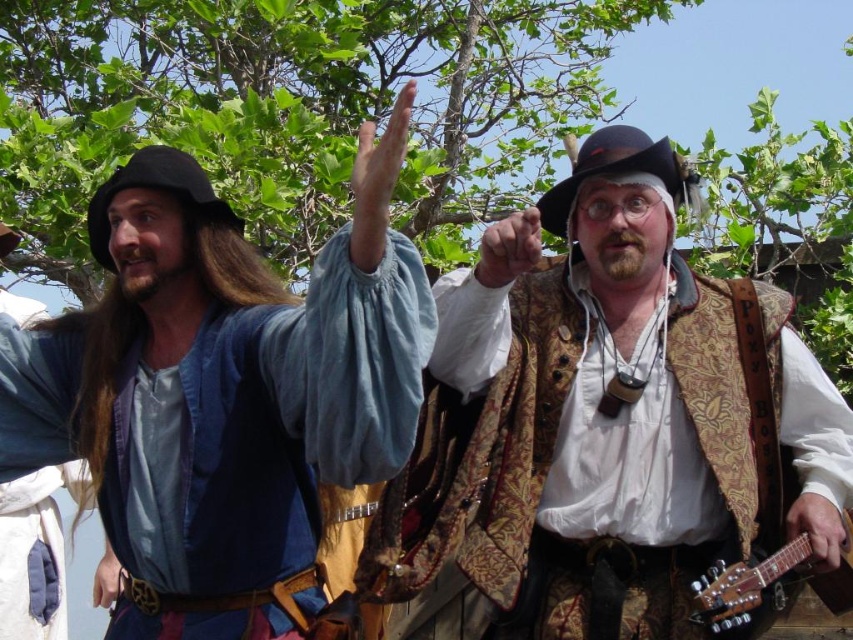
Which is below, gold-patterned vest at center or matte blue shirt at upper left?

gold-patterned vest at center is lower down.

Between point (567, 420) and point (231, 474), which one is positioned behind?

Positioned behind is point (567, 420).

Where is `gold-patterned vest at center`? This screenshot has height=640, width=853. gold-patterned vest at center is located at coordinates (601, 428).

Is white cotton shirt at left shorter than smooth skin hand at upper center?

In fact, white cotton shirt at left may be taller than smooth skin hand at upper center.

Can you confirm if white cotton shirt at left is wider than smooth skin hand at upper center?

Correct, the width of white cotton shirt at left exceeds that of smooth skin hand at upper center.

Find the location of `white cotton shirt at left`. white cotton shirt at left is located at coordinates (36, 550).

You are a GUI agent. You are given a task and a screenshot of the screen. Output one action in this format:
    pyautogui.click(x=<x>, y=<y>)
    Task: Click on the white cotton shirt at left
    
    Given the screenshot: What is the action you would take?
    pyautogui.click(x=36, y=550)

Does point (158, 170) lie behind point (706, 609)?

Yes.

Which is in front, point (199, 177) or point (851, 538)?

Point (851, 538) is more forward.

Describe the element at coordinates (157, 189) in the screenshot. This screenshot has width=853, height=640. I see `black felt cowboy hat at left` at that location.

At what (x,y) coordinates should I click in order to perform the action: click on black felt cowboy hat at left. Please return your answer as a coordinate pair (x, y). Looking at the image, I should click on (157, 189).